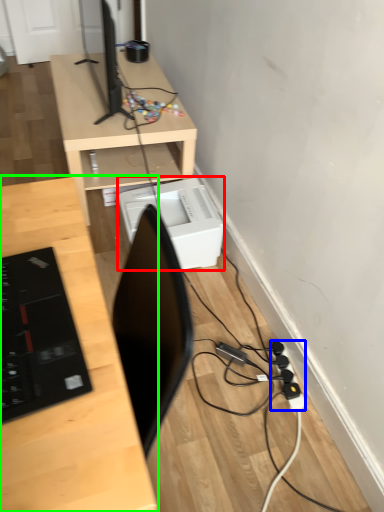
Question: Which is nearer to the printer (highlighted by a red box)? extension cord (highlighted by a blue box) or desk (highlighted by a green box).

Choices:
 (A) extension cord
 (B) desk

Answer: (A)